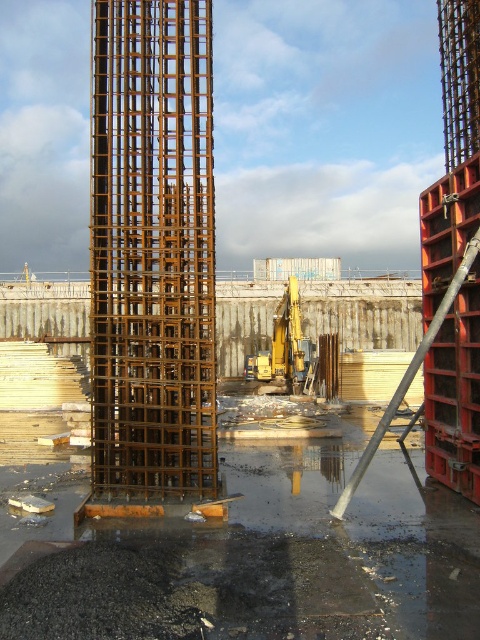
Question: Considering the relative positions of rusty metal tower at left and yellow metallic excavator at center in the image provided, where is rusty metal tower at left located with respect to yellow metallic excavator at center?

Choices:
 (A) above
 (B) below

Answer: (A)

Question: Which point appears farthest from the camera in this image?

Choices:
 (A) (294, 330)
 (B) (130, 29)

Answer: (A)

Question: Does rusty metal tower at left have a lesser width compared to yellow metallic excavator at center?

Choices:
 (A) yes
 (B) no

Answer: (A)

Question: Observing the image, what is the correct spatial positioning of rusty metal tower at left in reference to yellow metallic excavator at center?

Choices:
 (A) below
 (B) above

Answer: (B)

Question: Which of the following is the closest to the observer?

Choices:
 (A) yellow metallic excavator at center
 (B) rusty metal tower at left

Answer: (B)